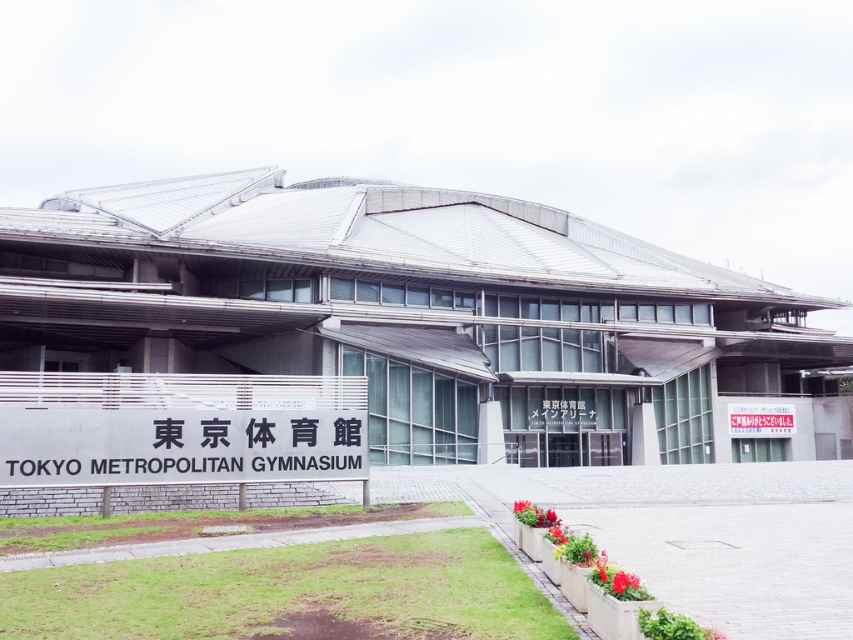
Question: Which point is closer to the camera?

Choices:
 (A) white paper sign at center
 (B) black sign at center

Answer: (B)

Question: Does black sign at center lie behind white paper sign at center?

Choices:
 (A) no
 (B) yes

Answer: (A)

Question: Which point is farther from the camera taking this photo?

Choices:
 (A) (787, 428)
 (B) (45, 484)

Answer: (A)

Question: Does black sign at center have a lesser width compared to white paper sign at center?

Choices:
 (A) no
 (B) yes

Answer: (B)

Question: Is the position of black sign at center less distant than that of white paper sign at center?

Choices:
 (A) no
 (B) yes

Answer: (B)